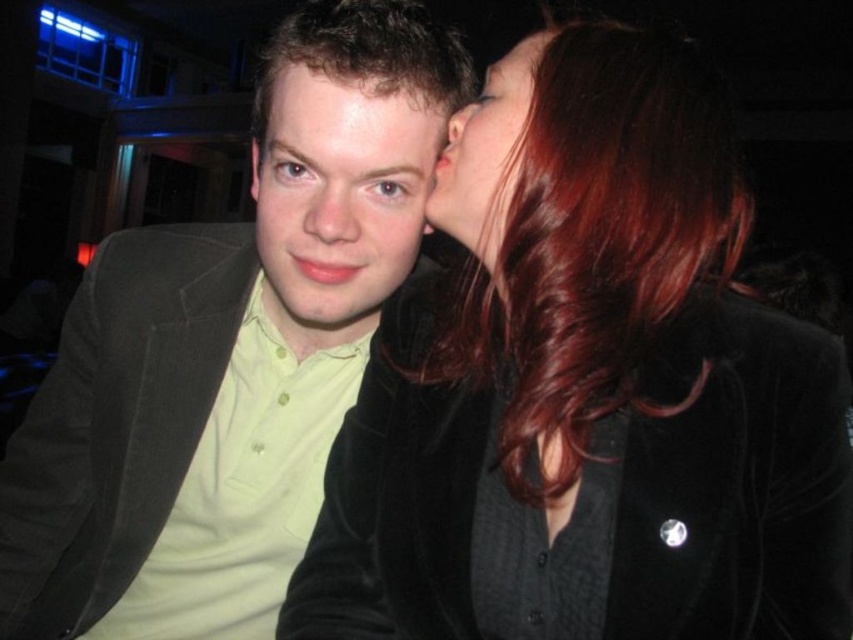
Consider the image. Who is shorter, matte green shirt at center or matte black hair at upper center?

matte black hair at upper center is shorter.

Who is positioned more to the left, matte green shirt at center or matte black hair at upper center?

matte green shirt at center is more to the left.

Does point (375, 138) come farther from viewer compared to point (479, 248)?

That is True.

This screenshot has height=640, width=853. I want to click on matte green shirt at center, so click(x=339, y=196).

Can you confirm if matte black jacket at center is positioned below matte black hair at upper center?

Yes.

Between matte black jacket at center and matte black hair at upper center, which one has more height?

With more height is matte black jacket at center.

Which is behind, point (364, 298) or point (469, 147)?

The point (364, 298) is more distant.

At what (x,y) coordinates should I click in order to perform the action: click on matte black jacket at center. Please return your answer as a coordinate pair (x, y). Image resolution: width=853 pixels, height=640 pixels. Looking at the image, I should click on coord(228,352).

Looking at this image, is shiny black hair at upper right below matte black hair at upper center?

Yes.

In the scene shown: Who is higher up, shiny black hair at upper right or matte black hair at upper center?

matte black hair at upper center is higher up.

Locate an element on the screen. The width and height of the screenshot is (853, 640). shiny black hair at upper right is located at coordinates (587, 387).